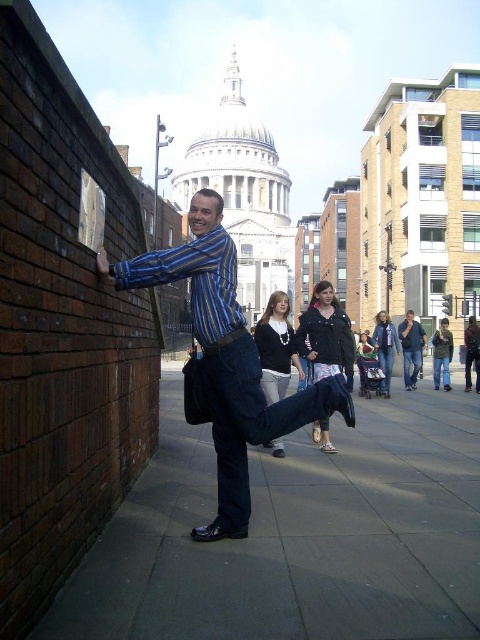
Can you confirm if dark blue denim jeans at center is smaller than denim jacket at center?

Incorrect, dark blue denim jeans at center is not smaller in size than denim jacket at center.

Identify the location of dark blue denim jeans at center. (x=325, y=336).

Can you confirm if dark blue denim jeans at center is positioned to the left of dark gray sweater at center?

No, dark blue denim jeans at center is not to the left of dark gray sweater at center.

Does point (325, 291) lie in front of point (274, 440)?

No, (325, 291) is behind (274, 440).

This screenshot has height=640, width=480. I want to click on dark blue denim jeans at center, so click(x=325, y=336).

Looking at this image, can you confirm if gray concrete pavement at lower center is wider than dark blue jeans at center?

Correct, the width of gray concrete pavement at lower center exceeds that of dark blue jeans at center.

The width and height of the screenshot is (480, 640). What do you see at coordinates (296, 536) in the screenshot?
I see `gray concrete pavement at lower center` at bounding box center [296, 536].

The image size is (480, 640). I want to click on gray concrete pavement at lower center, so click(x=296, y=536).